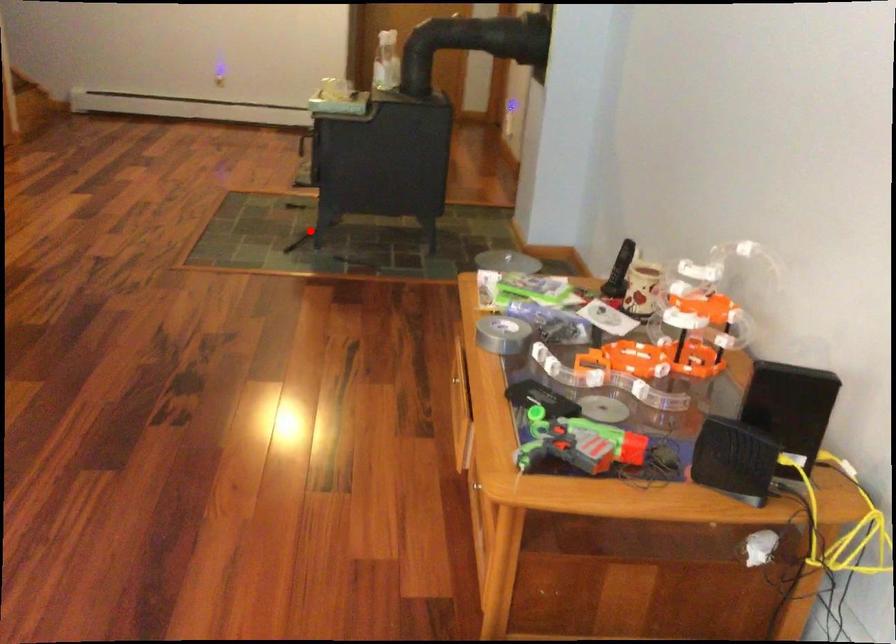
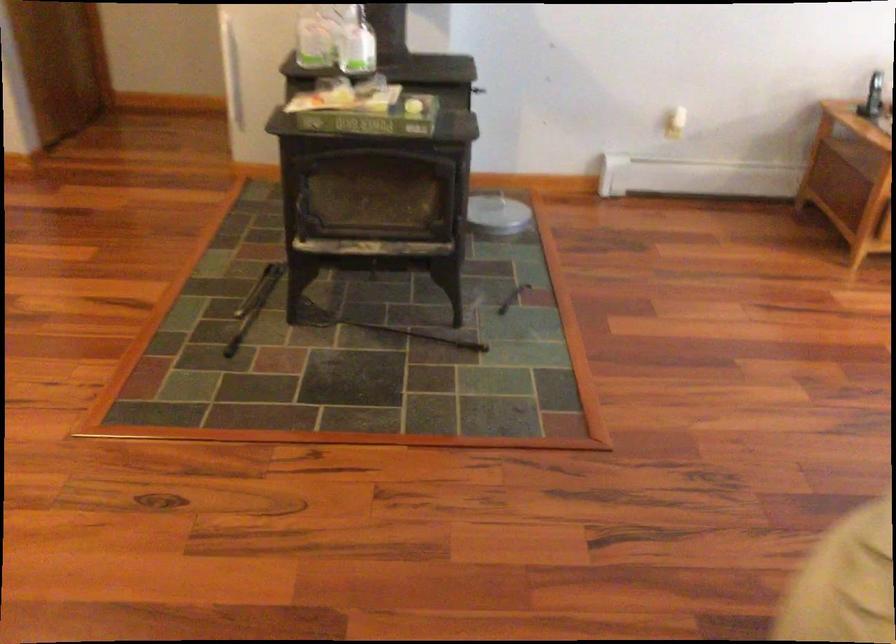
Locate, in the second image, the point that corresponds to the highlighted location in the first image.

(380, 327)